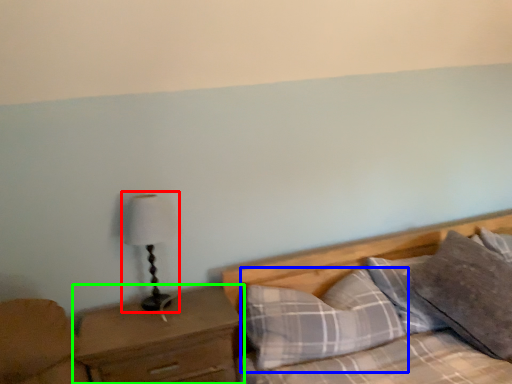
Question: Which object is positioned farthest from table lamp (highlighted by a red box)? Select from pillow (highlighted by a blue box) and nightstand (highlighted by a green box).

Choices:
 (A) pillow
 (B) nightstand

Answer: (A)